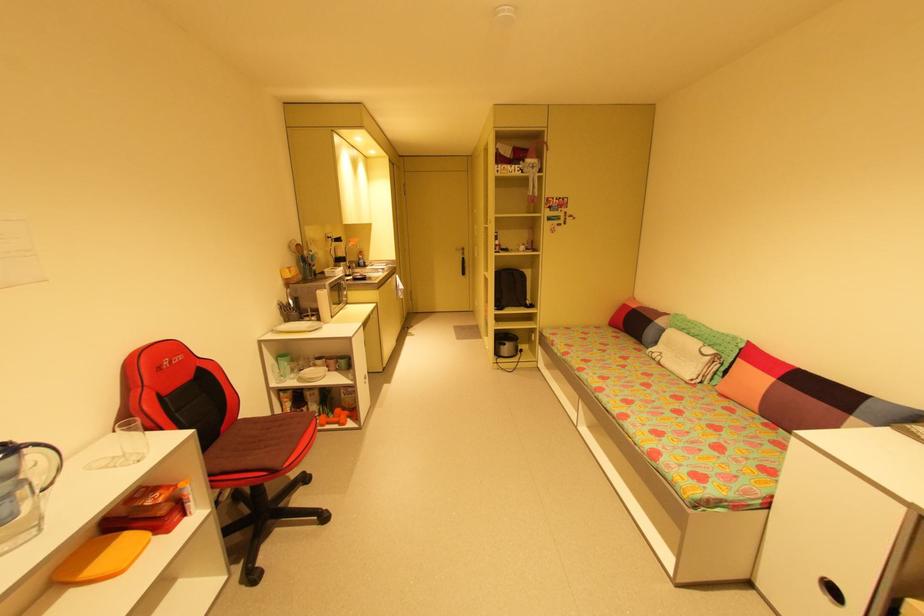
Image resolution: width=924 pixels, height=616 pixels. Find the location of `clear glass cup`. clear glass cup is located at coordinates (131, 440).